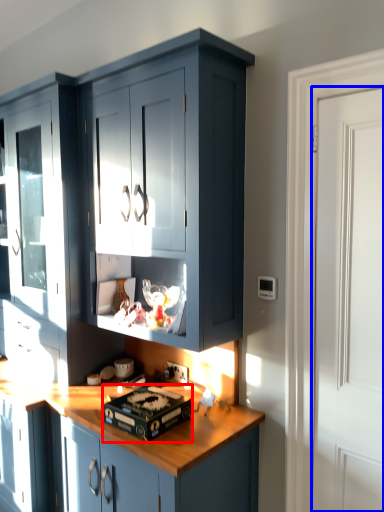
Question: Among these objects, which one is nearest to the camera, appliance (highlighted by a red box) or door (highlighted by a blue box)?

Choices:
 (A) appliance
 (B) door

Answer: (B)